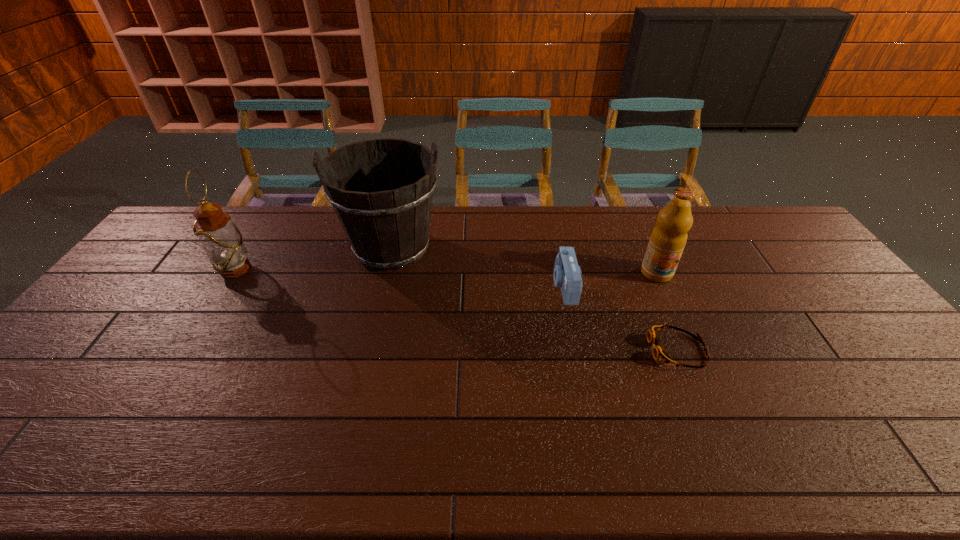
I want to click on bucket, so [387, 225].

Where is `oil lamp`? Image resolution: width=960 pixels, height=540 pixels. oil lamp is located at coordinates (222, 241).

Identify the location of the third tallest object. This screenshot has height=540, width=960. [667, 241].

You are a GUI agent. You are given a task and a screenshot of the screen. Output one action in this format:
    pyautogui.click(x=<x>, y=<y>)
    Task: Click on the third object from left to right
    Image resolution: width=960 pixels, height=540 pixels.
    Given the screenshot: What is the action you would take?
    pyautogui.click(x=567, y=273)

I want to click on the second shortest object, so click(x=567, y=273).

In order to click on the shortest object in this screenshot , I will do `click(659, 353)`.

You are a GUI agent. You are given a task and a screenshot of the screen. Output one action in this format:
    pyautogui.click(x=<x>, y=<y>)
    Task: Click on the nearest object
    
    Given the screenshot: What is the action you would take?
    pyautogui.click(x=659, y=353)

This screenshot has width=960, height=540. I want to click on vacant region located 0.250m on the left of the second object from left to right, so click(x=266, y=248).

You are a GUI agent. You are given a task and a screenshot of the screen. Output one action in this format:
    pyautogui.click(x=<x>, y=<y>)
    Task: Click on the free point located on the front of the oil lamp
    
    Given the screenshot: What is the action you would take?
    pyautogui.click(x=205, y=317)

You are a GUI agent. You are given a task and a screenshot of the screen. Output one action in this format:
    pyautogui.click(x=<x>, y=<y>)
    Task: Click on the free space located 0.280m on the front label of the third tallest object
    
    Given the screenshot: What is the action you would take?
    pyautogui.click(x=694, y=356)